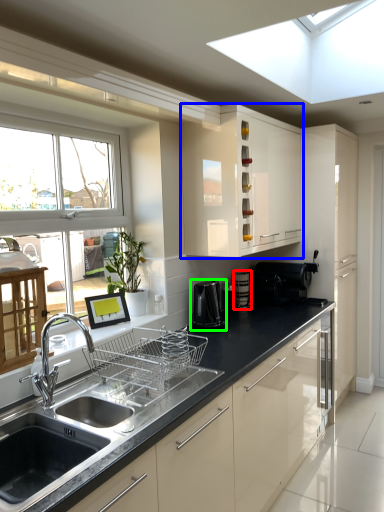
Question: Which object is the closest to the appliance (highlighted by a red box)? Choose among these: cabinetry (highlighted by a blue box) or coffee machine (highlighted by a green box).

Choices:
 (A) cabinetry
 (B) coffee machine

Answer: (B)